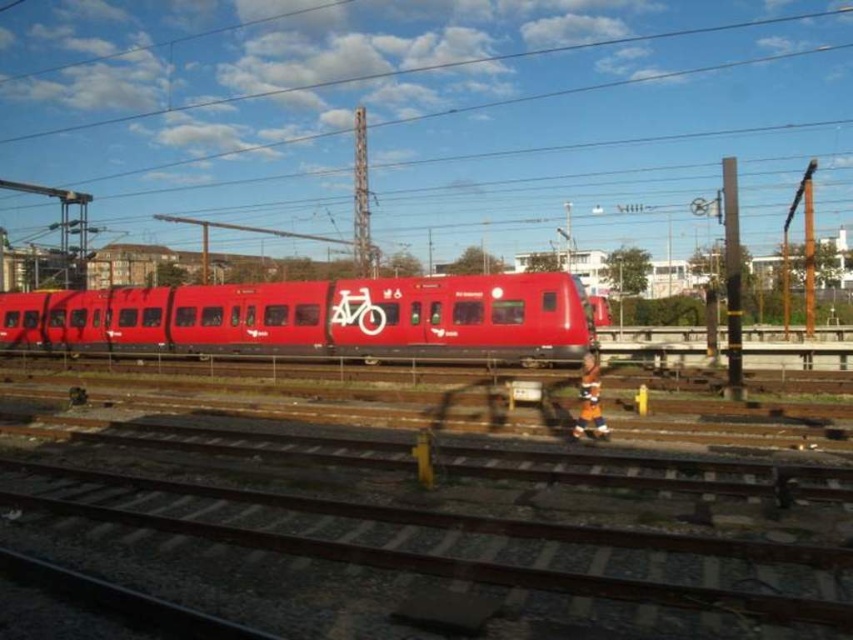
Based on the photo, you are a railway engineer assessing the space between the brown metallic track at lower center and the matte red train at center. Can the track accommodate a standard cargo container that requires 10 meters of space?

The brown metallic track at lower center is smaller than the matte red train at center, so it may not have enough space to accommodate a standard cargo container requiring 10 meters of space.

You are a passenger waiting at the railway station and see the brown metallic track at lower center and the matte red train at center. Which object is closer to you as you stand at the platform?

The brown metallic track at lower center is closer to you because it is in front of the matte red train at center, meaning it is positioned nearer to your viewpoint on the platform.

You are standing at the railway station and want to take a photo of the red train with the white bicycle symbol. You notice two points marked at coordinates point [643,531] and point [444,355]. Which point should you stand closer to in order to have the train fill more of your camera frame?

To have the train fill more of your camera frame, you should stand closer to point [643,531] because it is closer to the viewer than point [444,355].